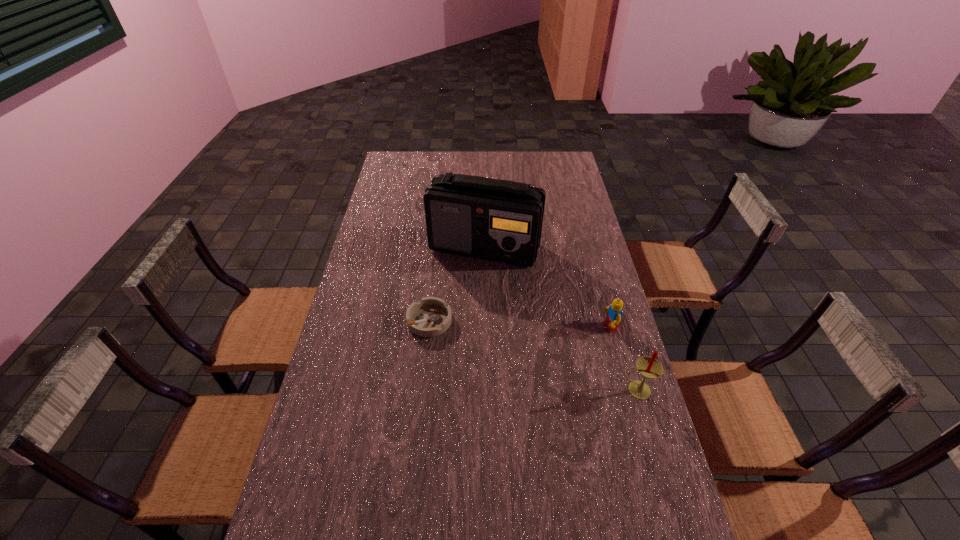
You are a GUI agent. You are given a task and a screenshot of the screen. Output one action in this format:
    pyautogui.click(x=<x>, y=<y>)
    Task: Click on the vacant space located on the front-facing side of the Lego
    
    Given the screenshot: What is the action you would take?
    pyautogui.click(x=543, y=338)

At what (x,y) coordinates should I click in order to perform the action: click on vacant space situated 0.380m on the front panel of the farthest object. Please return your answer as a coordinate pair (x, y). Image resolution: width=960 pixels, height=540 pixels. Looking at the image, I should click on (534, 351).

Identify the location of vacant space located 0.230m on the front panel of the farthest object. (518, 315).

This screenshot has height=540, width=960. I want to click on vacant space located 0.080m on the front panel of the farthest object, so click(x=506, y=284).

In order to click on candle that is at the right edge in this screenshot , I will do `click(650, 368)`.

At what (x,y) coordinates should I click in order to perform the action: click on Lego present at the right edge. Please return your answer as a coordinate pair (x, y). This screenshot has height=540, width=960. Looking at the image, I should click on coord(614,313).

Identify the location of vacant space at the near edge of the desktop. The height and width of the screenshot is (540, 960). (518, 538).

Locate an element on the screen. The height and width of the screenshot is (540, 960). free spot at the left edge of the desktop is located at coordinates (380, 186).

You are a GUI agent. You are given a task and a screenshot of the screen. Output one action in this format:
    pyautogui.click(x=<x>, y=<y>)
    Task: Click on the blank space at the right edge
    The width and height of the screenshot is (960, 540).
    Given the screenshot: What is the action you would take?
    pyautogui.click(x=588, y=217)

Where is `vacant space at the far right corner of the desktop`? vacant space at the far right corner of the desktop is located at coordinates tap(564, 154).